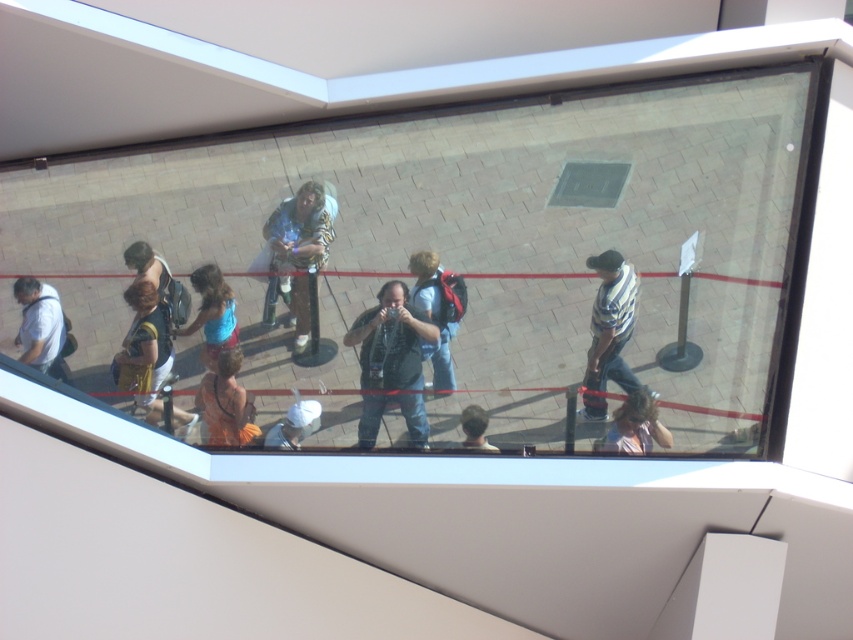
Question: Which point is closer to the camera taking this photo?

Choices:
 (A) (476, 420)
 (B) (646, 388)

Answer: (B)

Question: Is matte gray shirt at left to the right of blue cotton shirt at center from the viewer's perspective?

Choices:
 (A) no
 (B) yes

Answer: (A)

Question: Which of these objects is positioned closest to the matte black camera at center?

Choices:
 (A) white matte hat at center
 (B) orange cotton shirt at center
 (C) striped fabric jacket at center
 (D) light brown hair at center

Answer: (D)

Question: Is striped fabric jacket at center positioned at the back of matte black sunglasses at lower right?

Choices:
 (A) no
 (B) yes

Answer: (B)

Question: Is orange cotton shirt at center to the left of white matte hat at center from the viewer's perspective?

Choices:
 (A) no
 (B) yes

Answer: (B)

Question: Considering the real-world distances, which object is farthest from the striped fabric jacket at center?

Choices:
 (A) white matte hat at center
 (B) dark brown leather jacket at lower left

Answer: (B)